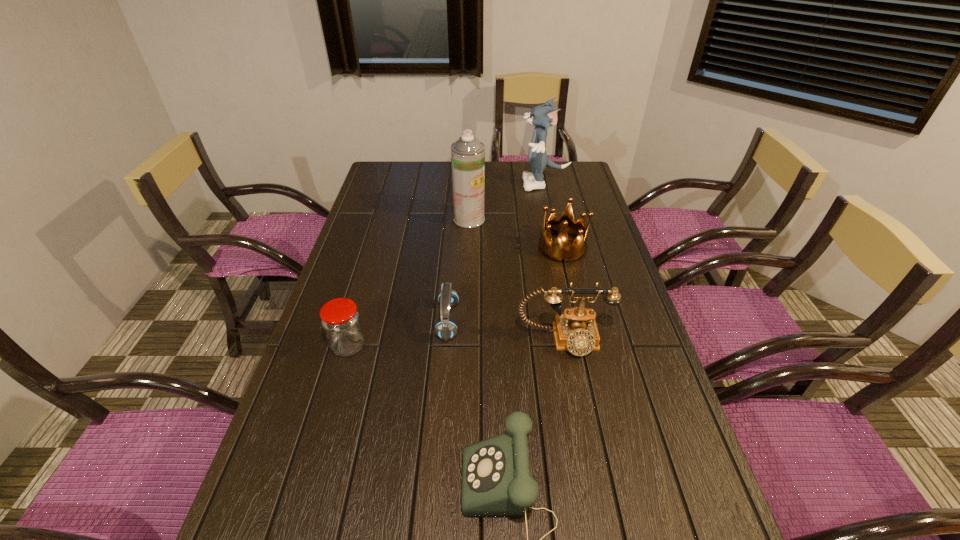
The image size is (960, 540). What are the coordinates of `free space at the left edge of the desktop` in the screenshot? It's located at (374, 249).

Find the location of a particular element. The width and height of the screenshot is (960, 540). free spot at the right edge of the desktop is located at coordinates (631, 423).

Find the location of a particular element. vacant space at the far right corner is located at coordinates (553, 177).

Identify the location of vacant point located between the aerosol can and the farther telephone. Image resolution: width=960 pixels, height=540 pixels. (516, 280).

This screenshot has width=960, height=540. In order to click on vacant space that's between the farthest object and the sixth nearest object in this screenshot , I will do `click(507, 201)`.

You are a GUI agent. You are given a task and a screenshot of the screen. Output one action in this format:
    pyautogui.click(x=<x>, y=<y>)
    Task: Click on the vacant space that's between the cat and the aerosol can
    This screenshot has width=960, height=540.
    Given the screenshot: What is the action you would take?
    pyautogui.click(x=507, y=201)

Locate which object is the fourth closest to the farther telephone. Please provide its 2D coordinates. Your answer should be formatted as a tuple, i.e. [(x, y)], where the tuple contains the x and y coordinates of a point satisfying the conditions above.

[(340, 319)]

This screenshot has width=960, height=540. Identify the location of object that is the sixth closest one to the farthest object. (496, 480).